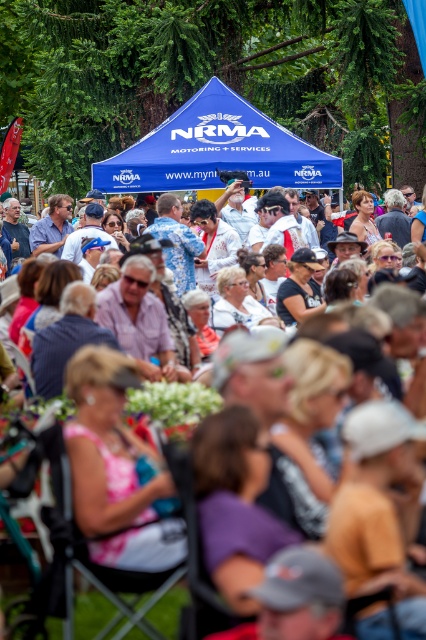
You are a photographer at the event and want to capture a photo of the matte white shirts at center without the blue fabric canopy at center appearing in the shot. Is this possible given their positions?

The blue fabric canopy at center is positioned over the matte white shirts at center, so it would block the view. Therefore, capturing the matte white shirts at center without the canopy in the shot is not possible unless the canopy is moved or the angle is adjusted to avoid it.

From the picture: You are a photographer at the event and want to capture a photo that includes both the blue fabric canopy at center and the matte white shirts at center. Considering their sizes, which object should you focus on to ensure both are in frame without needing to adjust your camera angle?

The blue fabric canopy at center is much taller than the matte white shirts at center, so you should focus on the blue fabric canopy at center to ensure both are in frame without needing to adjust your camera angle.

You are standing at the back of the crowd at the NRMA event and want to take a photo of both the point at coordinates (117, 160) and the point at (106, 608). Which point will appear closer to the camera in your photo?

Point (117, 160) will appear closer to the camera in the photo because it is further to the camera than point (106, 608).